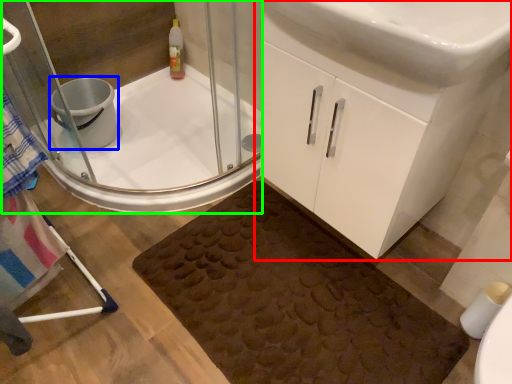
Question: Based on their relative distances, which object is nearer to bathroom cabinet (highlighted by a red box)? Choose from toilet bowl (highlighted by a blue box) and shower door (highlighted by a green box).

Choices:
 (A) toilet bowl
 (B) shower door

Answer: (B)